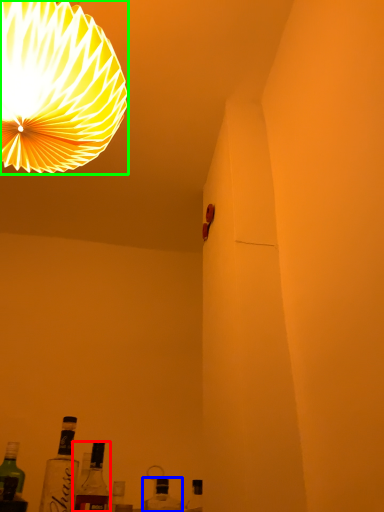
Question: Which is nearer to the bottle (highlighted by a red box)? bottle (highlighted by a blue box) or lamp (highlighted by a green box).

Choices:
 (A) bottle
 (B) lamp

Answer: (A)